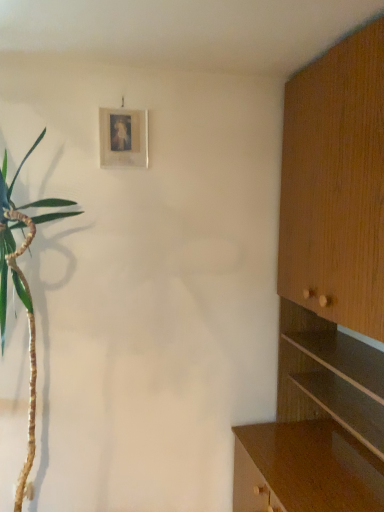
Question: From the image's perspective, relative to wooden cabinet at right, is matte wooden picture frame at upper center above or below?

Choices:
 (A) above
 (B) below

Answer: (A)

Question: Considering their positions, is matte wooden picture frame at upper center located in front of or behind wooden cabinet at right?

Choices:
 (A) front
 (B) behind

Answer: (B)

Question: Considering the positions of matte wooden picture frame at upper center and wooden cabinet at right in the image, is matte wooden picture frame at upper center bigger or smaller than wooden cabinet at right?

Choices:
 (A) small
 (B) big

Answer: (A)

Question: Is wooden cabinet at right taller or shorter than matte wooden picture frame at upper center?

Choices:
 (A) short
 (B) tall

Answer: (B)

Question: From a real-world perspective, is wooden cabinet at right above or below matte wooden picture frame at upper center?

Choices:
 (A) above
 (B) below

Answer: (B)

Question: Do you think wooden cabinet at right is within matte wooden picture frame at upper center, or outside of it?

Choices:
 (A) outside
 (B) inside

Answer: (A)

Question: Considering the relative positions of wooden cabinet at right and matte wooden picture frame at upper center in the image provided, is wooden cabinet at right to the left or to the right of matte wooden picture frame at upper center?

Choices:
 (A) left
 (B) right

Answer: (B)